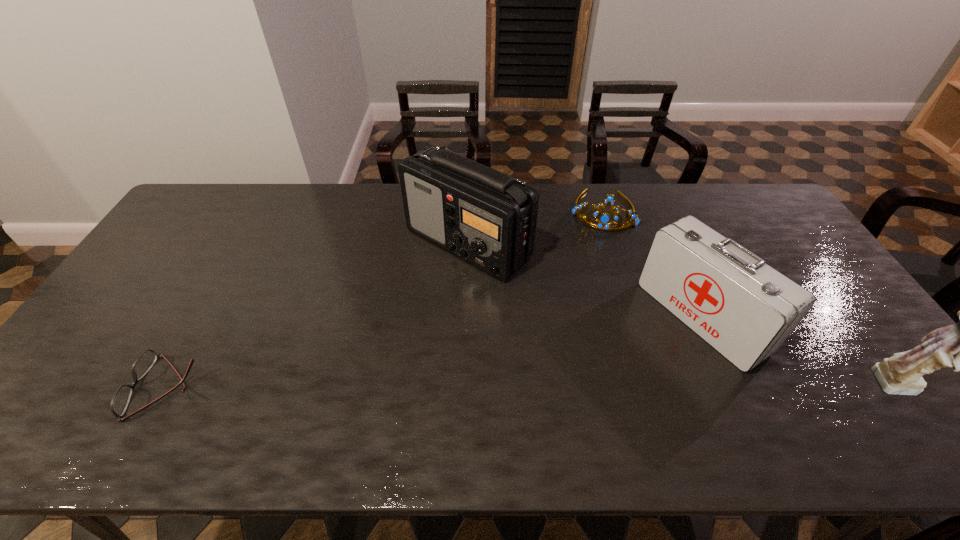
In order to click on spectacles in this screenshot , I will do pos(121,398).

Find the location of a particular element. the leftmost object is located at coordinates (121, 398).

Where is `figurine`? This screenshot has height=540, width=960. figurine is located at coordinates (901, 374).

Identify the location of the first-aid kit. [x=745, y=309].

This screenshot has height=540, width=960. I want to click on tiara, so click(x=604, y=219).

Find the location of a particular element. This screenshot has width=960, height=540. radio receiver is located at coordinates (487, 218).

Where is `free point located on the front-facing side of the shortest object`? free point located on the front-facing side of the shortest object is located at coordinates (113, 387).

Find the location of a particular element. free region located on the front-facing side of the shortest object is located at coordinates (81, 387).

Image resolution: width=960 pixels, height=540 pixels. I want to click on free location located on the front-facing side of the shortest object, so click(x=63, y=387).

Where is `free space located on the front-facing side of the third tallest object`? The width and height of the screenshot is (960, 540). free space located on the front-facing side of the third tallest object is located at coordinates (619, 376).